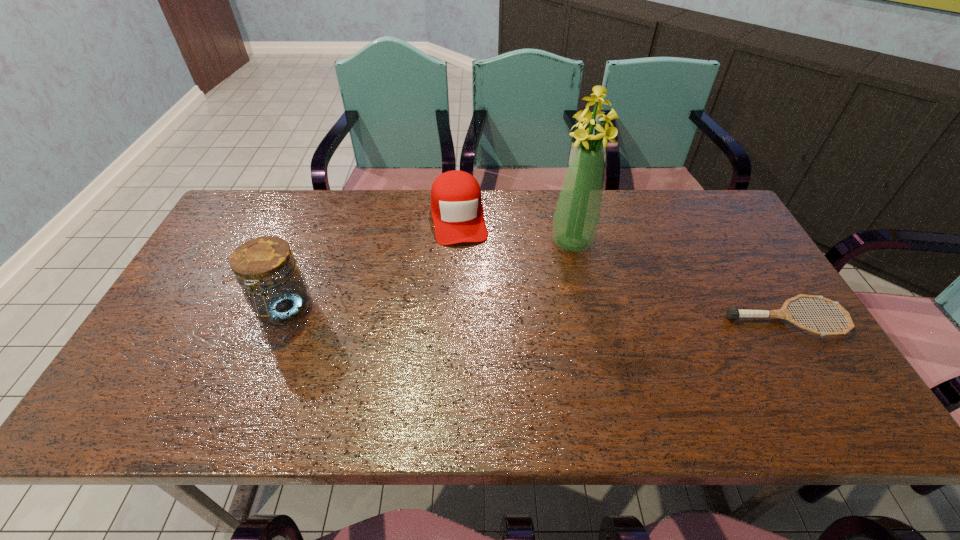
You are a GUI agent. You are given a task and a screenshot of the screen. Output one action in this format:
    pyautogui.click(x=<x>, y=<y>)
    Task: Click on the free space at the near edge of the desktop
    
    Given the screenshot: What is the action you would take?
    pyautogui.click(x=609, y=356)

In the image, there is a desktop. Identify the location of vacant space at the left edge. (226, 241).

Locate an element on the screen. The image size is (960, 540). vacant point at the right edge is located at coordinates (746, 263).

Image resolution: width=960 pixels, height=540 pixels. Identify the location of free space at the far left corner of the desktop. (252, 201).

Where is `free space at the far right corner of the desktop`? The width and height of the screenshot is (960, 540). free space at the far right corner of the desktop is located at coordinates (704, 221).

Identify the location of vacant space that is in between the third object from right to left and the bouquet. The width and height of the screenshot is (960, 540). [516, 229].

This screenshot has height=540, width=960. In order to click on free area in between the tennis racket and the baseball cap in this screenshot , I will do `click(622, 267)`.

Locate an element on the screen. Image resolution: width=960 pixels, height=540 pixels. vacant space that is in between the second tallest object and the tallest object is located at coordinates (428, 276).

You are a GUI agent. You are given a task and a screenshot of the screen. Output one action in this format:
    pyautogui.click(x=<x>, y=<y>)
    Task: Click on the vacant area between the third object from right to left and the leftmost object
    
    Given the screenshot: What is the action you would take?
    pyautogui.click(x=372, y=263)

In order to click on vacant area that lies between the jar and the tallest object in this screenshot , I will do `click(428, 276)`.